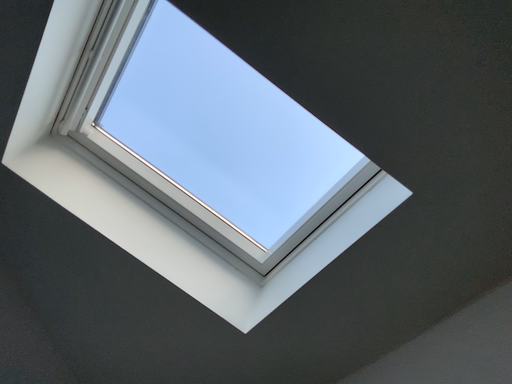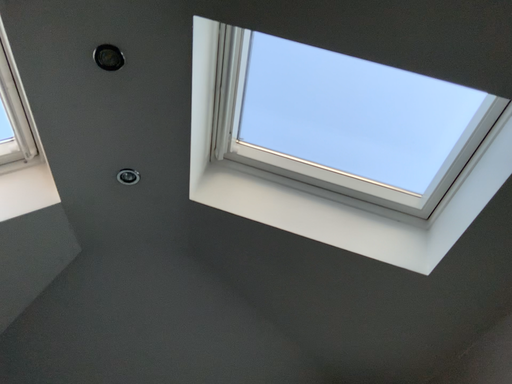
Question: How did the camera likely rotate when shooting the video?

Choices:
 (A) rotated downward
 (B) rotated upward

Answer: (A)